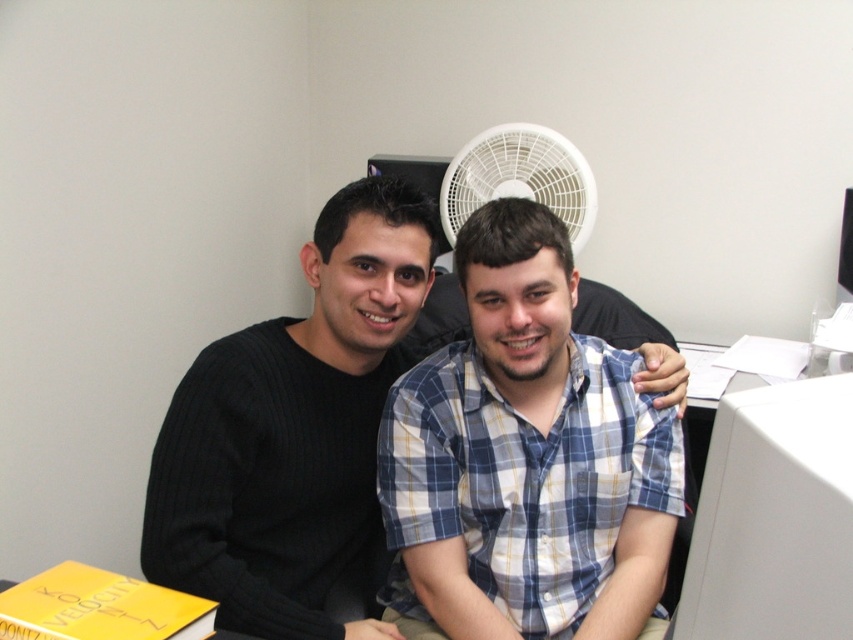
You are organizing a meeting in this office and need to place a name tag on the desk. The name tag must be placed between the blue plaid shirt at center and the white plastic fan at upper center. Is there enough space between them to place the name tag?

The blue plaid shirt at center is to the left of the white plastic fan at upper center, so there is space between them to place the name tag.

In the scene shown: You are a delivery robot with a package that is 20 inches wide. You need to place the package between the blue plaid shirt at center and the white plastic monitor at right. Can you fit the package in that space?

The distance between the blue plaid shirt at center and the white plastic monitor at right is 20.39 inches, so the package which is 20 inches wide can fit in that space.